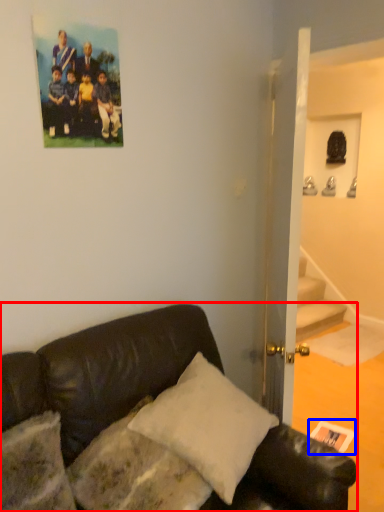
Question: Which of the following is the closest to the observer, studio couch (highlighted by a red box) or postcard (highlighted by a blue box)?

Choices:
 (A) studio couch
 (B) postcard

Answer: (A)